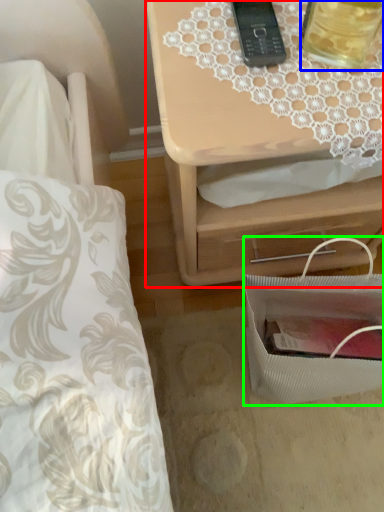
Question: Which object is the farthest from nightstand (highlighted by a red box)? Choose among these: beverage (highlighted by a blue box) or bag (highlighted by a green box).

Choices:
 (A) beverage
 (B) bag

Answer: (A)